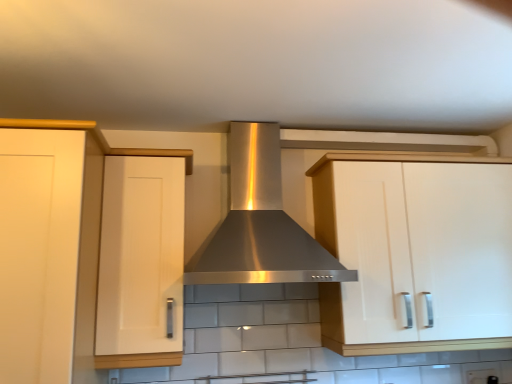
Describe the element at coordinates (141, 263) in the screenshot. I see `white matte cabinet at left, the 2th cabinetry positioned from the right` at that location.

Find the location of a particular element. stainless steel range hood at center is located at coordinates (261, 222).

What do you see at coordinates (261, 222) in the screenshot? I see `stainless steel range hood at center` at bounding box center [261, 222].

You are a GUI agent. You are given a task and a screenshot of the screen. Output one action in this format:
    pyautogui.click(x=<x>, y=<y>)
    Task: Click on the white matte cabinet at left, the 2th cabinetry when ordered from left to right
    
    Given the screenshot: What is the action you would take?
    pyautogui.click(x=141, y=263)

Is white glossy cabinet at right, positioned as the first cabinetry in right-to-left order, to the right of matte white cabinet at left, which appears as the 1th cabinetry when viewed from the left, from the viewer's perspective?

Correct, you'll find white glossy cabinet at right, positioned as the first cabinetry in right-to-left order, to the right of matte white cabinet at left, which appears as the 1th cabinetry when viewed from the left.

Looking at their sizes, would you say white glossy cabinet at right, positioned as the first cabinetry in right-to-left order, is wider or thinner than matte white cabinet at left, which appears as the 1th cabinetry when viewed from the left?

Clearly, white glossy cabinet at right, positioned as the first cabinetry in right-to-left order, has less width compared to matte white cabinet at left, which appears as the 1th cabinetry when viewed from the left.

From the image's perspective, is white glossy cabinet at right, positioned as the first cabinetry in right-to-left order, located beneath matte white cabinet at left, which is the 3th cabinetry from right to left?

Incorrect, from the image's perspective, white glossy cabinet at right, positioned as the first cabinetry in right-to-left order, is higher than matte white cabinet at left, which is the 3th cabinetry from right to left.

From the white glossy cabinet at right, positioned as the first cabinetry in right-to-left order, count 2nd cabinetrys forward and point to it. Please provide its 2D coordinates.

[(39, 251)]

Based on the photo, is matte white cabinet at left, which is the 3th cabinetry from right to left, not inside stainless steel range hood at center?

Absolutely, matte white cabinet at left, which is the 3th cabinetry from right to left, is external to stainless steel range hood at center.

Considering the relative sizes of matte white cabinet at left, which appears as the 1th cabinetry when viewed from the left, and stainless steel range hood at center in the image provided, is matte white cabinet at left, which appears as the 1th cabinetry when viewed from the left, taller than stainless steel range hood at center?

Yes, matte white cabinet at left, which appears as the 1th cabinetry when viewed from the left, is taller than stainless steel range hood at center.

Which is closer to the camera, (74, 138) or (331, 265)?

Point (74, 138).

Does matte white cabinet at left, which is the 3th cabinetry from right to left, have a greater width compared to stainless steel range hood at center?

Indeed, matte white cabinet at left, which is the 3th cabinetry from right to left, has a greater width compared to stainless steel range hood at center.

In terms of size, does matte white cabinet at left, which appears as the 1th cabinetry when viewed from the left, appear bigger or smaller than white matte cabinet at left, the 2th cabinetry when ordered from left to right?

Considering their sizes, matte white cabinet at left, which appears as the 1th cabinetry when viewed from the left, takes up more space than white matte cabinet at left, the 2th cabinetry when ordered from left to right.

Between matte white cabinet at left, which is the 3th cabinetry from right to left, and white matte cabinet at left, the 2th cabinetry positioned from the right, which one appears on the right side from the viewer's perspective?

Positioned to the right is white matte cabinet at left, the 2th cabinetry positioned from the right.

From a real-world perspective, which object stands above the other?

white matte cabinet at left, the 2th cabinetry positioned from the right, from a real-world perspective.

From the picture: How different are the orientations of white matte cabinet at left, the 2th cabinetry when ordered from left to right, and stainless steel range hood at center in degrees?

The angular difference between white matte cabinet at left, the 2th cabinetry when ordered from left to right, and stainless steel range hood at center is 0.00276 degrees.

How distant is white matte cabinet at left, the 2th cabinetry when ordered from left to right, from stainless steel range hood at center?

The distance of white matte cabinet at left, the 2th cabinetry when ordered from left to right, from stainless steel range hood at center is 12.25 inches.

Find the location of a particular element. The width and height of the screenshot is (512, 384). the 1st cabinetry below the stainless steel range hood at center (from the image's perspective) is located at coordinates (141, 263).

From the image's perspective, does white matte cabinet at left, the 2th cabinetry positioned from the right, appear higher than stainless steel range hood at center?

No, from the image's perspective, white matte cabinet at left, the 2th cabinetry positioned from the right, is not over stainless steel range hood at center.

Looking at their sizes, would you say stainless steel range hood at center is wider or thinner than matte white cabinet at left, which is the 3th cabinetry from right to left?

In the image, stainless steel range hood at center appears to be more narrow than matte white cabinet at left, which is the 3th cabinetry from right to left.

From a real-world perspective, who is located lower, stainless steel range hood at center or matte white cabinet at left, which appears as the 1th cabinetry when viewed from the left?

matte white cabinet at left, which appears as the 1th cabinetry when viewed from the left, is physically lower.

From the picture: Is stainless steel range hood at center directly adjacent to matte white cabinet at left, which is the 3th cabinetry from right to left?

stainless steel range hood at center is not next to matte white cabinet at left, which is the 3th cabinetry from right to left, and they're not touching.

This screenshot has width=512, height=384. I want to click on cabinetry that is the 2nd object located behind the stainless steel range hood at center, so click(361, 161).

From the image's perspective, which one is positioned higher, stainless steel range hood at center or white glossy cabinet at right, positioned as the first cabinetry in right-to-left order?

stainless steel range hood at center appears higher in the image.

Would you say stainless steel range hood at center is outside white glossy cabinet at right, positioned as the first cabinetry in right-to-left order?

Yes.

Considering the relative sizes of stainless steel range hood at center and white glossy cabinet at right, positioned as the first cabinetry in right-to-left order, in the image provided, is stainless steel range hood at center smaller than white glossy cabinet at right, positioned as the first cabinetry in right-to-left order,?

Indeed, stainless steel range hood at center has a smaller size compared to white glossy cabinet at right, positioned as the first cabinetry in right-to-left order.

Between stainless steel range hood at center and white matte cabinet at left, the 2th cabinetry positioned from the right, which one appears on the left side from the viewer's perspective?

white matte cabinet at left, the 2th cabinetry positioned from the right.

Is stainless steel range hood at center not inside white matte cabinet at left, the 2th cabinetry positioned from the right?

stainless steel range hood at center lies outside white matte cabinet at left, the 2th cabinetry positioned from the right,'s area.

How different are the orientations of stainless steel range hood at center and white matte cabinet at left, the 2th cabinetry positioned from the right, in degrees?

They differ by 0.00276 degrees in their facing directions.

Is stainless steel range hood at center closer to camera compared to white matte cabinet at left, the 2th cabinetry positioned from the right?

Yes, it is.

You are a GUI agent. You are given a task and a screenshot of the screen. Output one action in this format:
    pyautogui.click(x=<x>, y=<y>)
    Task: Click on the 2nd cabinetry in front of the white glossy cabinet at right, the third cabinetry from the left
    
    Given the screenshot: What is the action you would take?
    pyautogui.click(x=39, y=251)

What are the coordinates of `the 3rd cabinetry directly beneath the stainless steel range hood at center (from a real-world perspective)` in the screenshot? It's located at (39, 251).

Based on their spatial positions, is stainless steel range hood at center or white glossy cabinet at right, positioned as the first cabinetry in right-to-left order, closer to matte white cabinet at left, which is the 3th cabinetry from right to left?

stainless steel range hood at center lies closer to matte white cabinet at left, which is the 3th cabinetry from right to left, than the other object.

From the image, which object appears to be farther from stainless steel range hood at center, white glossy cabinet at right, positioned as the first cabinetry in right-to-left order, or white matte cabinet at left, the 2th cabinetry when ordered from left to right?

white glossy cabinet at right, positioned as the first cabinetry in right-to-left order.

Estimate the real-world distances between objects in this image. Which object is closer to matte white cabinet at left, which is the 3th cabinetry from right to left, white glossy cabinet at right, the third cabinetry from the left, or white matte cabinet at left, the 2th cabinetry when ordered from left to right?

The object closer to matte white cabinet at left, which is the 3th cabinetry from right to left, is white matte cabinet at left, the 2th cabinetry when ordered from left to right.

Estimate the real-world distances between objects in this image. Which object is closer to white glossy cabinet at right, positioned as the first cabinetry in right-to-left order, white matte cabinet at left, the 2th cabinetry positioned from the right, or stainless steel range hood at center?

stainless steel range hood at center is closer to white glossy cabinet at right, positioned as the first cabinetry in right-to-left order.

Looking at the image, which one is located further to white matte cabinet at left, the 2th cabinetry positioned from the right, stainless steel range hood at center or white glossy cabinet at right, positioned as the first cabinetry in right-to-left order?

The object further to white matte cabinet at left, the 2th cabinetry positioned from the right, is white glossy cabinet at right, positioned as the first cabinetry in right-to-left order.

Looking at the image, which one is located further to stainless steel range hood at center, white glossy cabinet at right, positioned as the first cabinetry in right-to-left order, or matte white cabinet at left, which appears as the 1th cabinetry when viewed from the left?

matte white cabinet at left, which appears as the 1th cabinetry when viewed from the left, is further to stainless steel range hood at center.

Based on their spatial positions, is stainless steel range hood at center or white matte cabinet at left, the 2th cabinetry when ordered from left to right, further from matte white cabinet at left, which appears as the 1th cabinetry when viewed from the left?

stainless steel range hood at center.

Looking at the image, which one is located further to stainless steel range hood at center, white matte cabinet at left, the 2th cabinetry when ordered from left to right, or white glossy cabinet at right, the third cabinetry from the left?

white glossy cabinet at right, the third cabinetry from the left, lies further to stainless steel range hood at center than the other object.

Find the location of a particular element. cabinetry located between matte white cabinet at left, which appears as the 1th cabinetry when viewed from the left, and stainless steel range hood at center in the left-right direction is located at coordinates (141, 263).

Identify the location of home appliance located between white matte cabinet at left, the 2th cabinetry positioned from the right, and white glossy cabinet at right, the third cabinetry from the left, in the left-right direction. Image resolution: width=512 pixels, height=384 pixels. (261, 222).

Locate an element on the screen. This screenshot has height=384, width=512. cabinetry between matte white cabinet at left, which is the 3th cabinetry from right to left, and white glossy cabinet at right, positioned as the first cabinetry in right-to-left order, from left to right is located at coordinates (141, 263).

Locate an element on the screen. This screenshot has width=512, height=384. home appliance situated between matte white cabinet at left, which appears as the 1th cabinetry when viewed from the left, and white glossy cabinet at right, positioned as the first cabinetry in right-to-left order, from left to right is located at coordinates (261, 222).